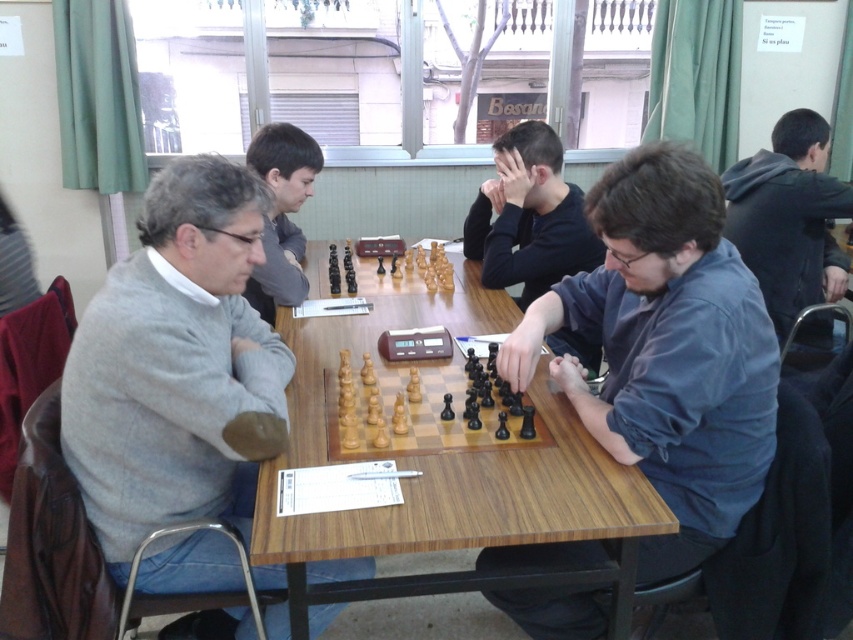
Question: Can you confirm if blue shirt at center is bigger than light wood chess set at center?

Choices:
 (A) yes
 (B) no

Answer: (A)

Question: Which object appears farthest from the camera in this image?

Choices:
 (A) gray sweater at left
 (B) wooden chess set at center

Answer: (B)

Question: Which of the following is the farthest from the observer?

Choices:
 (A) (769, 218)
 (B) (273, 250)

Answer: (A)

Question: Can you confirm if blue shirt at center is wider than light wood chess set at center?

Choices:
 (A) no
 (B) yes

Answer: (B)

Question: Is blue shirt at center bigger than light wood chess set at center?

Choices:
 (A) no
 (B) yes

Answer: (B)

Question: Which of these objects is positioned closest to the dark blue shirt at center?

Choices:
 (A) smooth gray sweater at upper left
 (B) dark gray hoodie at center
 (C) gray sweater at left

Answer: (A)